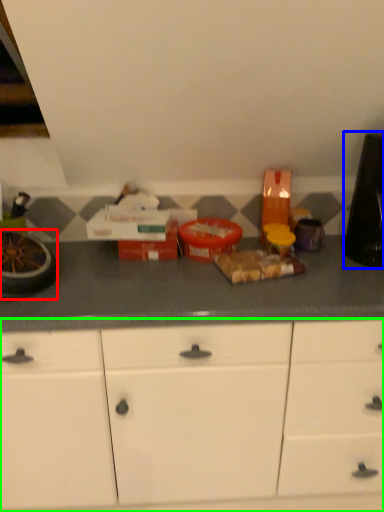
Question: Based on their relative distances, which object is farther from appliance (highlighted by a red box)? Choose from appliance (highlighted by a blue box) and cabinetry (highlighted by a green box).

Choices:
 (A) appliance
 (B) cabinetry

Answer: (A)